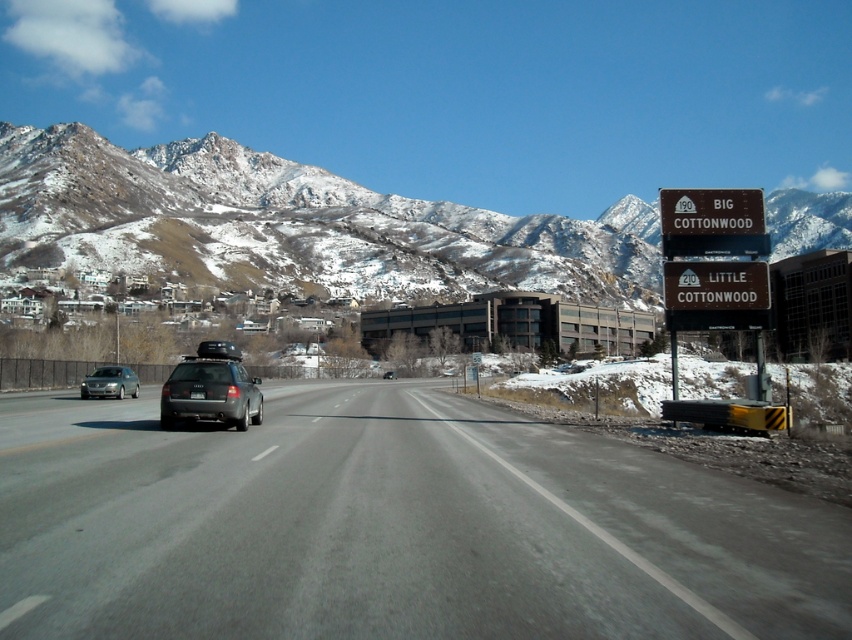
Based on the photo, you are driving a car and see the image. There is a gray asphalt road at center. Where is the gray asphalt road at center located relative to the point with coordinates (392, 528)?

The gray asphalt road at center is located at the point with coordinates (392, 528).